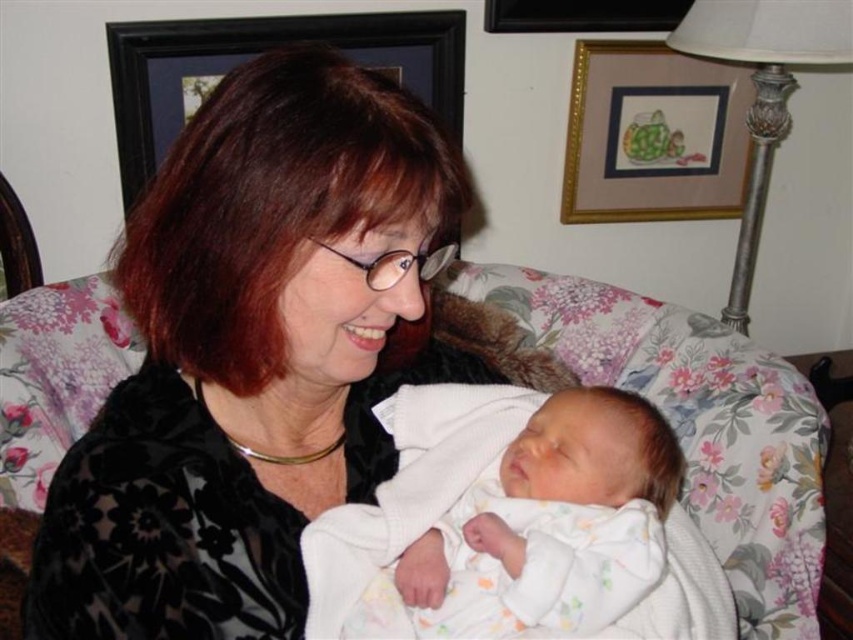
Can you confirm if wooden picture frame at upper center is thinner than black wooden picture frame at upper center?

Incorrect, wooden picture frame at upper center's width is not less than black wooden picture frame at upper center's.

Is point (578, 216) farther from camera compared to point (631, 3)?

That is True.

The image size is (853, 640). I want to click on wooden picture frame at upper center, so click(x=653, y=134).

Who is more forward, (x=164, y=225) or (x=577, y=3)?

Point (x=164, y=225)

Is matte black blouse at center positioned behind black wooden picture frame at upper center?

No, matte black blouse at center is in front of black wooden picture frame at upper center.

Image resolution: width=853 pixels, height=640 pixels. What do you see at coordinates (253, 355) in the screenshot?
I see `matte black blouse at center` at bounding box center [253, 355].

Find the location of `matte black blouse at center`. matte black blouse at center is located at coordinates (253, 355).

Who is shorter, black framed picture at upper center or black wooden picture frame at upper center?

Standing shorter between the two is black wooden picture frame at upper center.

Which is behind, point (358, 45) or point (689, 1)?

Positioned behind is point (689, 1).

The width and height of the screenshot is (853, 640). What are the coordinates of `black framed picture at upper center` in the screenshot? It's located at (257, 52).

Locate an element on the screen. The image size is (853, 640). black framed picture at upper center is located at coordinates (257, 52).